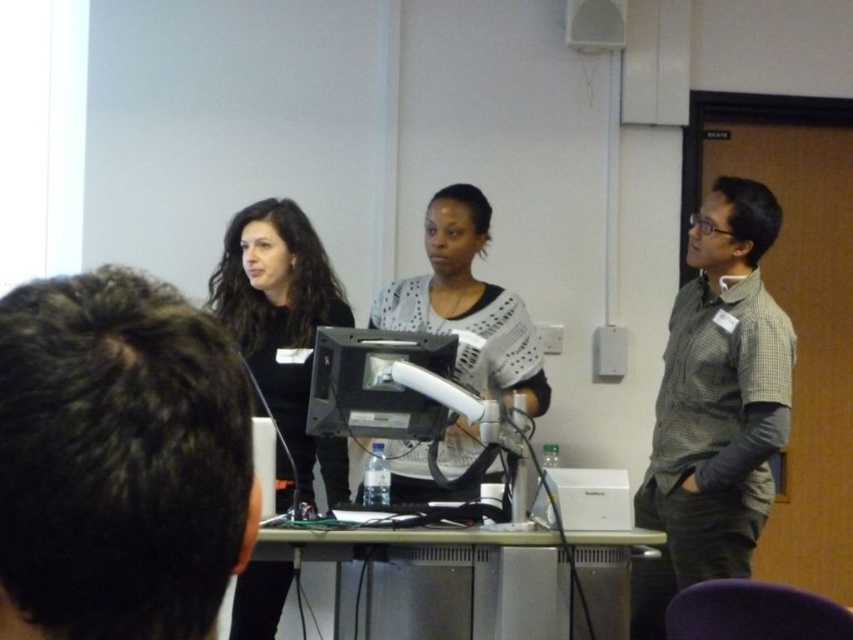
You are standing at the front of the classroom and want to place a new item between the two points labeled point (283,262) and point (440,458). Based on their positions, which point should be closer to the front of the room?

Point (440,458) is closer to the front of the room because point (283,262) is behind it.

You are an event organizer arranging seating for a panel discussion. You need to place a name tag holder on the table between the checkered fabric shirt at right and the matte black shirt at center. Based on their positions, which side of the table should you place the name tag holder closer to?

The checkered fabric shirt at right is positioned under the matte black shirt at center, so the name tag holder should be placed closer to the right side of the table to accommodate both positions.